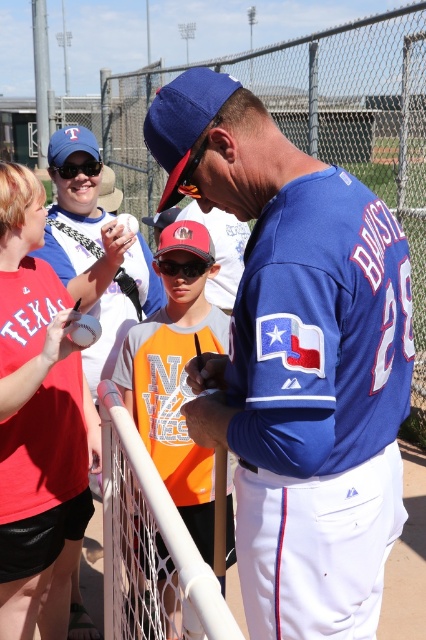
You are a photographer at the baseball field and need to capture a closeup shot of the black plastic goggles at center and the black plastic goggles at upper left. Which pair of goggles should you zoom in on to ensure they appear larger in your photo?

The black plastic goggles at upper left should be zoomed in on because they have a greater width than the black plastic goggles at center, making them naturally larger in the frame.

You are a photographer at the event and want to capture a clear photo of the black plastic goggles at center and the black plastic goggles at upper left. Which pair of goggles will appear larger in the photo?

The black plastic goggles at center will appear larger in the photo because they are closer to the viewer than the black plastic goggles at upper left.

You are standing at the baseball field and want to know which of the two points, point (368,413) or point (207,234), is closer to you. Can you determine this based on the scene?

Point (368,413) is closer to the viewer than point (207,234).